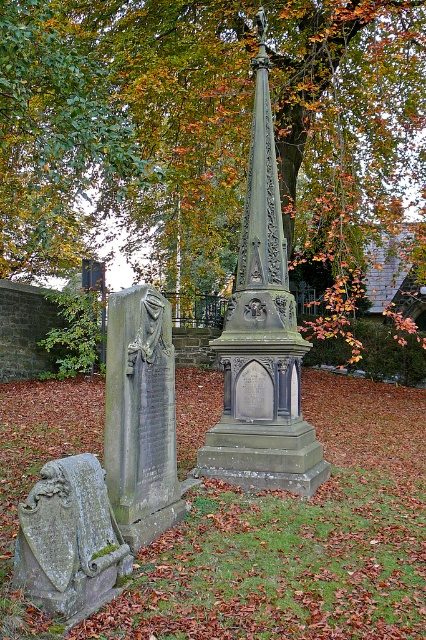
From the picture: You are standing in the cemetery and want to place a wreath on the green mossy stone plaque at lower left. However, there is a dark gray stone monument at center in the way. Can you reach the plaque without moving the monument?

The dark gray stone monument at center is positioned over the green mossy stone plaque at lower left, so you cannot reach the plaque without moving the monument.

You are standing in the cemetery looking at the gray stone gravestone at left and the green mossy stone plaque at lower left. Which object is closer to you?

The gray stone gravestone at left is closer to you than the green mossy stone plaque at lower left.

You are a groundskeeper assessing the cemetery layout. You need to place a new flowerpot between the gray stone gravestone at left and the green mossy stone plaque at lower left. Considering their sizes, which object should the flowerpot be closer to?

The gray stone gravestone at left is larger than the green mossy stone plaque at lower left. Therefore, the flowerpot should be placed closer to the green mossy stone plaque at lower left to maintain balance between the two objects.